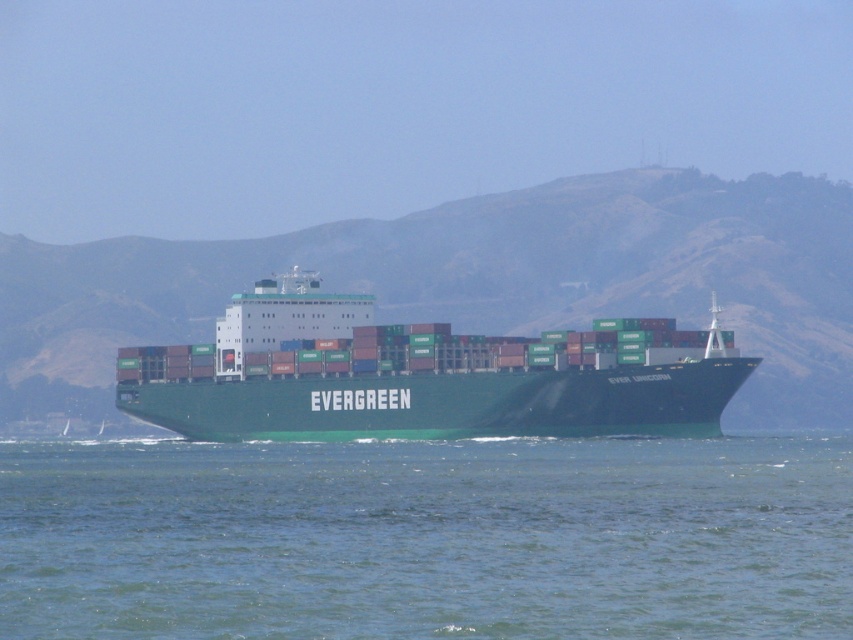
You are a seagull flying over the bay. You see the green water at center and the green matte container ship at center. Which one is closer to your left side?

The green water at center is to the left of the green matte container ship at center, so the green water at center is closer to your left side.

You are a photographer trying to capture the green matte container ship at center and the green water at center in a single frame. Based on their sizes, which one will appear larger in your photo?

The green matte container ship at center will appear larger in the photo because it is larger in size compared to the green water at center.

You are a photographer standing on the deck of the EVERGREEN ship. You want to take a photo of two specific points on the ship. The first point is at coordinates point (519,556) and the second point is at point (376,362). Which point will appear larger in your photo?

Point (519,556) is closer to the camera than point (376,362), so it will appear larger in the photo.